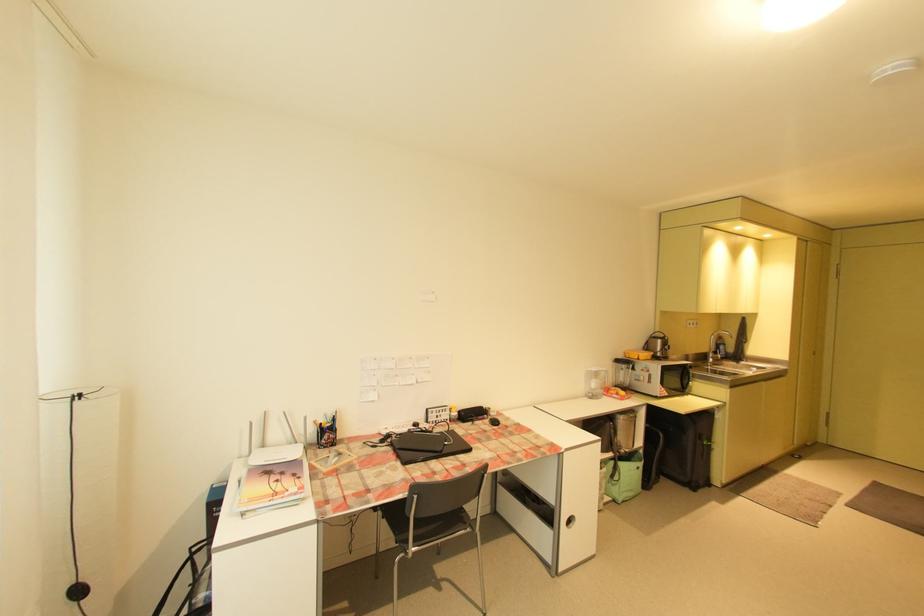
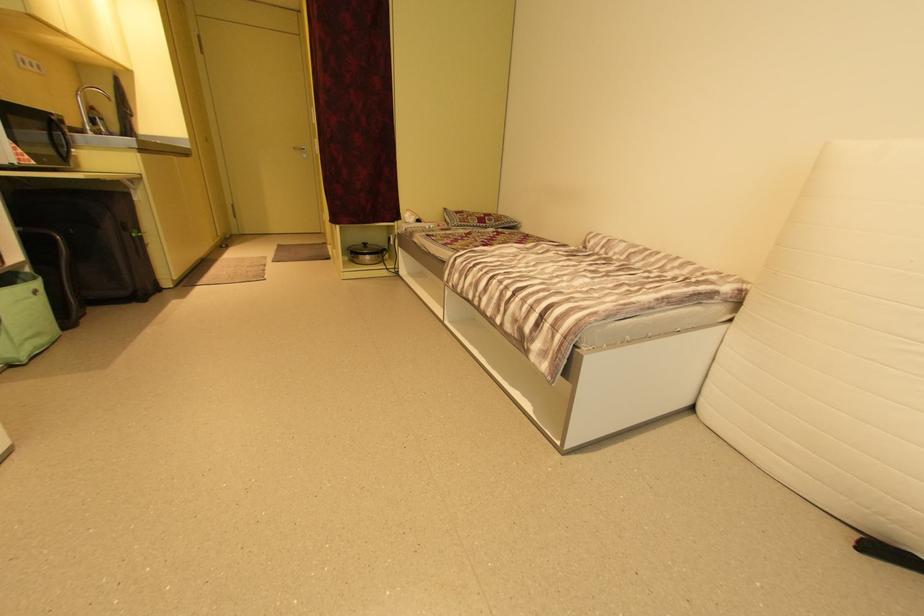
The first image is from the beginning of the video and the second image is from the end. How did the camera likely rotate when shooting the video?

The rotation direction of the camera is right-down.